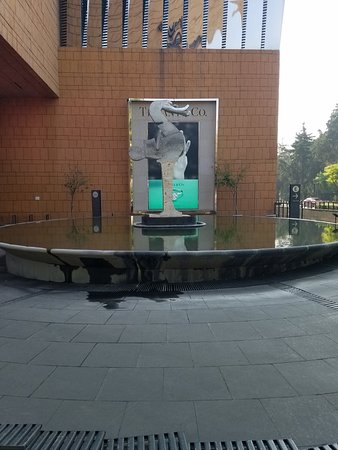
This screenshot has width=338, height=450. I want to click on wall, so click(x=231, y=276).